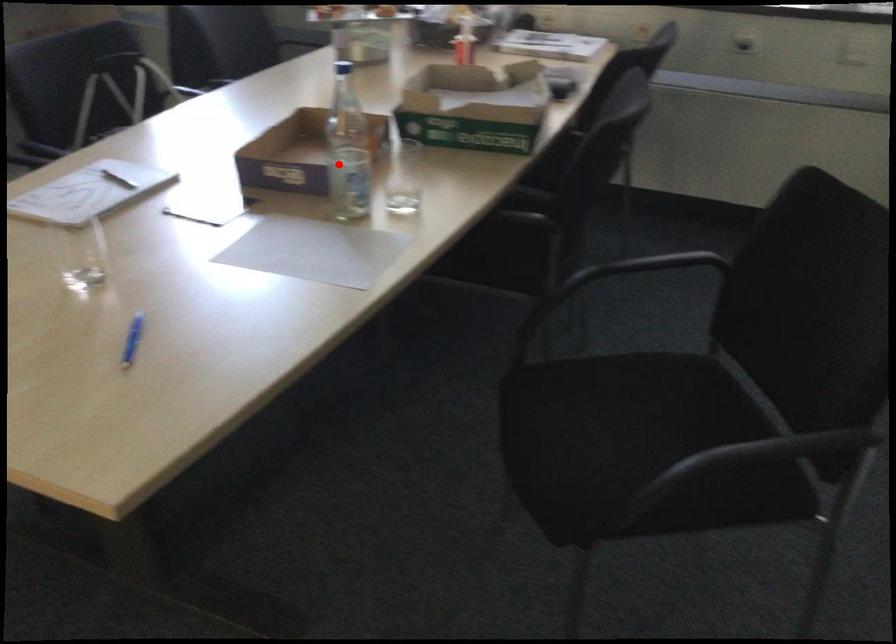
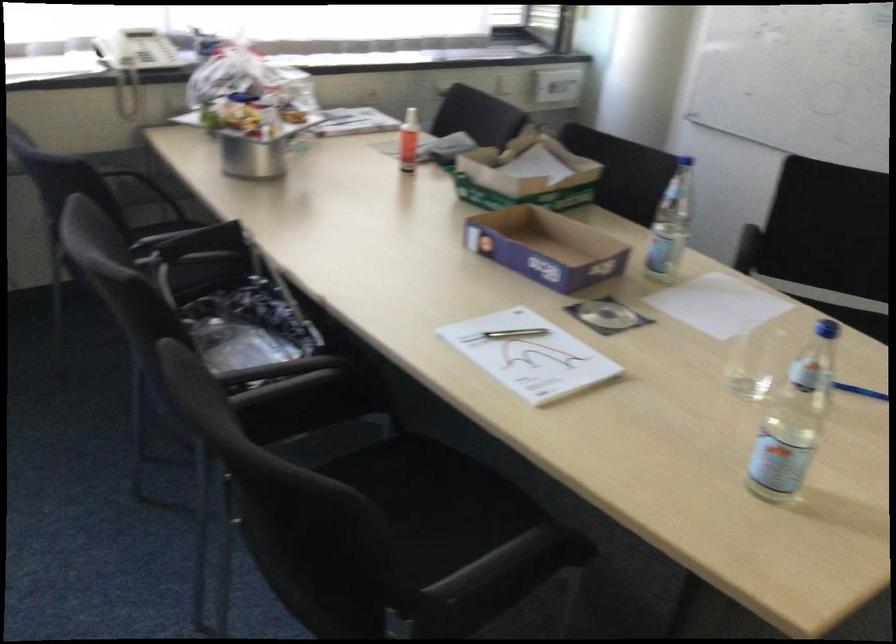
Question: I am providing you with two images of the same scene from different viewpoints. A red point is shown in image1. For the corresponding object point in image2, is it positioned nearer or farther from the camera?

Choices:
 (A) Nearer
 (B) Farther

Answer: (B)